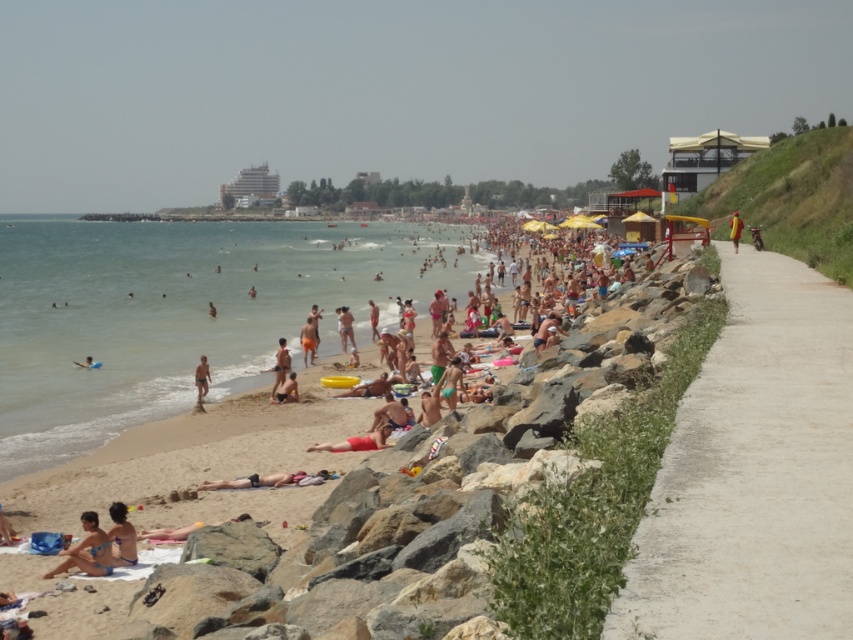
Is light brown sand at center bigger than concrete at right?

Actually, light brown sand at center might be smaller than concrete at right.

Which is more to the left, light brown sand at center or concrete at right?

light brown sand at center is more to the left.

This screenshot has height=640, width=853. I want to click on light brown sand at center, so click(x=289, y=520).

Locate an element on the screen. Image resolution: width=853 pixels, height=640 pixels. light brown sand at center is located at coordinates (289, 520).

Does clear blue water at beach left have a smaller size compared to tan skin person at beach center?

No.

Does clear blue water at beach left have a greater width compared to tan skin person at beach center?

Yes, clear blue water at beach left is wider than tan skin person at beach center.

Where is `clear blue water at beach left`? This screenshot has height=640, width=853. clear blue water at beach left is located at coordinates (180, 312).

At what (x,y) coordinates should I click in order to perform the action: click on clear blue water at beach left. Please return your answer as a coordinate pair (x, y). Image resolution: width=853 pixels, height=640 pixels. Looking at the image, I should click on pyautogui.click(x=180, y=312).

Who is lower down, concrete at right or tan skin human at center?

tan skin human at center is below.

Is concrete at right shorter than tan skin human at center?

No.

Is point (816, 573) positioned before point (282, 344)?

That is True.

Where is `concrete at right`? concrete at right is located at coordinates (753, 472).